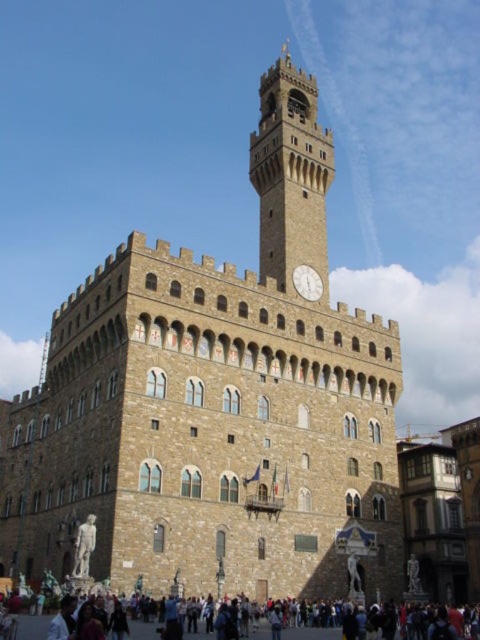
Looking at this image, you are an architect examining the building from the ground floor. You notice the brown stone clock tower at upper center and the white stone clock at center. Which one is located higher up in the building?

The brown stone clock tower at upper center is positioned over the white stone clock at center, so it is higher up in the building.

You are an architect examining the building and notice the brown stone clock tower at upper center and the white stone clock at center. Which one is positioned to the left side of the other?

The brown stone clock tower at upper center is to the left of the white stone clock at center.